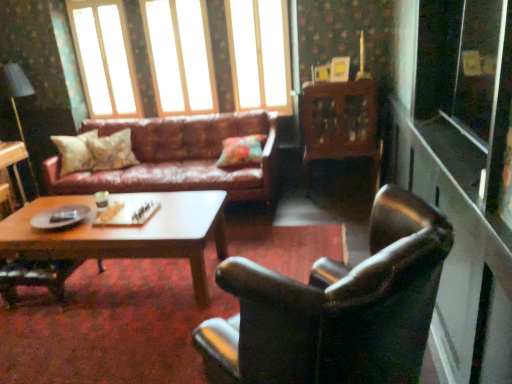
Question: Is matte black lampshade at upper left closer to the viewer compared to transparent glass screen door at right?

Choices:
 (A) no
 (B) yes

Answer: (A)

Question: Is matte black lampshade at upper left wider than transparent glass screen door at right?

Choices:
 (A) no
 (B) yes

Answer: (B)

Question: Would you say matte black lampshade at upper left contains transparent glass screen door at right?

Choices:
 (A) yes
 (B) no

Answer: (B)

Question: Considering the relative sizes of matte black lampshade at upper left and transparent glass screen door at right in the image provided, is matte black lampshade at upper left shorter than transparent glass screen door at right?

Choices:
 (A) yes
 (B) no

Answer: (B)

Question: Is matte black lampshade at upper left at the right side of transparent glass screen door at right?

Choices:
 (A) no
 (B) yes

Answer: (A)

Question: From a real-world perspective, is floral fabric cushion at center, the third pillow when ordered from left to right, physically located above or below transparent glass window at upper center, which appears as the second window when viewed from the right?

Choices:
 (A) below
 (B) above

Answer: (A)

Question: In terms of size, does floral fabric cushion at center, the third pillow when ordered from left to right, appear bigger or smaller than transparent glass window at upper center, which is the second window in left-to-right order?

Choices:
 (A) big
 (B) small

Answer: (B)

Question: From the image's perspective, is floral fabric cushion at center, which appears as the 1th pillow when viewed from the right, located above or below transparent glass window at upper center, which is the second window in left-to-right order?

Choices:
 (A) below
 (B) above

Answer: (A)

Question: Is point (244, 145) closer or farther from the camera than point (183, 77)?

Choices:
 (A) closer
 (B) farther

Answer: (A)

Question: Is transparent glass window at upper center, which appears as the second window when viewed from the right, taller or shorter than matte black lampshade at upper left?

Choices:
 (A) short
 (B) tall

Answer: (A)

Question: Is transparent glass window at upper center, which appears as the second window when viewed from the right, wider or thinner than matte black lampshade at upper left?

Choices:
 (A) thin
 (B) wide

Answer: (A)

Question: From a real-world perspective, is transparent glass window at upper center, which appears as the second window when viewed from the right, positioned above or below matte black lampshade at upper left?

Choices:
 (A) above
 (B) below

Answer: (A)

Question: Based on their positions, is transparent glass window at upper center, which appears as the second window when viewed from the right, located to the left or right of matte black lampshade at upper left?

Choices:
 (A) right
 (B) left

Answer: (A)

Question: Visually, is wooden cabinet at center positioned to the left or to the right of floral fabric pillow at center, the second pillow viewed from the right?

Choices:
 (A) left
 (B) right

Answer: (B)

Question: Is wooden cabinet at center inside or outside of floral fabric pillow at center, which is counted as the 2th pillow, starting from the left?

Choices:
 (A) outside
 (B) inside

Answer: (A)